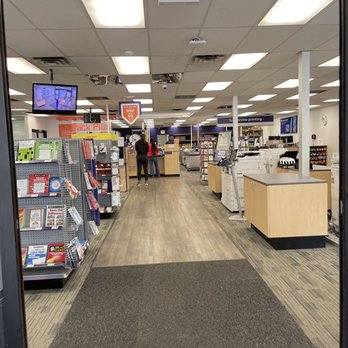
At what (x,y) coordinates should I click in order to perform the action: click on "exit" sign. Please return your answer as a coordinate pair (x, y). Image resolution: width=348 pixels, height=348 pixels. Looking at the image, I should click on (163, 132).